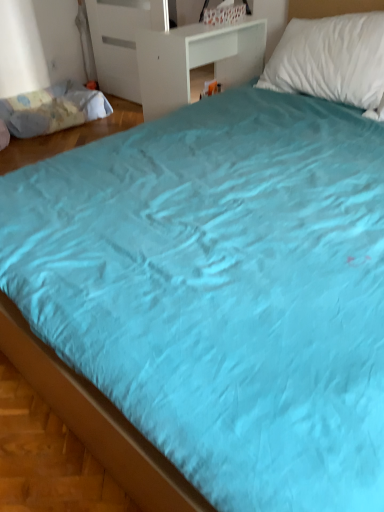
Question: From a real-world perspective, is light blue fabric mattress at left above or below white matte table at upper center?

Choices:
 (A) below
 (B) above

Answer: (A)

Question: In terms of size, does light blue fabric mattress at left appear bigger or smaller than white matte table at upper center?

Choices:
 (A) small
 (B) big

Answer: (A)

Question: Is light blue fabric mattress at left situated inside white matte table at upper center or outside?

Choices:
 (A) outside
 (B) inside

Answer: (A)

Question: From the image's perspective, is white matte table at upper center above or below light blue fabric mattress at left?

Choices:
 (A) above
 (B) below

Answer: (B)

Question: In the image, is white matte table at upper center on the left side or the right side of light blue fabric mattress at left?

Choices:
 (A) right
 (B) left

Answer: (A)

Question: In terms of height, does white matte table at upper center look taller or shorter compared to light blue fabric mattress at left?

Choices:
 (A) short
 (B) tall

Answer: (B)

Question: From a real-world perspective, is white matte table at upper center positioned above or below light blue fabric mattress at left?

Choices:
 (A) above
 (B) below

Answer: (A)